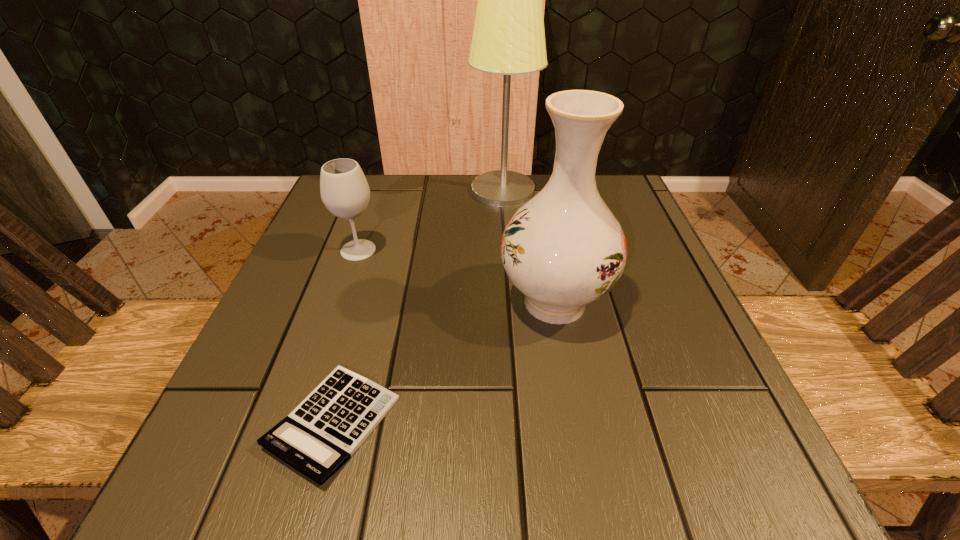
Locate an element on the screen. the closest object to the table lamp is located at coordinates 563,249.

Find the location of a particular element. Image resolution: width=960 pixels, height=540 pixels. object that ranks as the closest to the wineglass is located at coordinates (508, 38).

In order to click on free location that satisfies the following two spatial constraints: 1. on the front side of the third nearest object; 2. on the right side of the vase in this screenshot , I will do `click(341, 302)`.

Image resolution: width=960 pixels, height=540 pixels. Find the location of `free space in the image that satisfies the following two spatial constraints: 1. on the back side of the second nearest object; 2. on the right side of the shortest object`. free space in the image that satisfies the following two spatial constraints: 1. on the back side of the second nearest object; 2. on the right side of the shortest object is located at coordinates (367, 302).

Locate an element on the screen. The image size is (960, 540). vacant space that satisfies the following two spatial constraints: 1. on the front side of the shortest object; 2. on the left side of the second farthest object is located at coordinates (300, 422).

At what (x,y) coordinates should I click in order to perform the action: click on free point that satisfies the following two spatial constraints: 1. on the front side of the second nearest object; 2. on the left side of the wineglass. Please return your answer as a coordinate pair (x, y). This screenshot has height=540, width=960. Looking at the image, I should click on pos(341,302).